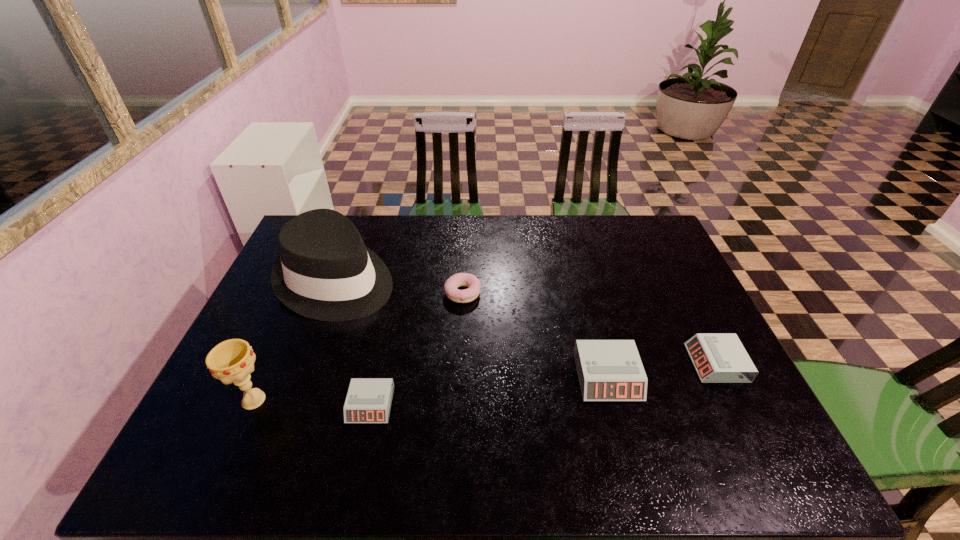
The width and height of the screenshot is (960, 540). What are the coordinates of `object present at the far left corner` in the screenshot? It's located at (325, 272).

Locate an element on the screen. The image size is (960, 540). object that is at the near left corner is located at coordinates point(232,361).

The height and width of the screenshot is (540, 960). Identify the location of free spot at the far edge of the desktop. (601, 230).

At what (x,y) coordinates should I click in order to perform the action: click on free space at the near edge of the desktop. Please return your answer as a coordinate pair (x, y). This screenshot has width=960, height=540. Looking at the image, I should click on (544, 404).

Find the location of a particular element. This screenshot has height=540, width=960. free spot at the right edge of the desktop is located at coordinates (693, 321).

Image resolution: width=960 pixels, height=540 pixels. In the image, there is a desktop. What are the coordinates of `vacant space at the near left corner` in the screenshot? It's located at (267, 396).

Identify the location of vacant space that is in between the doughnut and the tallest alarm clock. The height and width of the screenshot is (540, 960). (535, 334).

Locate an element on the screen. free point between the second object from right to left and the rightmost alarm clock is located at coordinates (661, 370).

Locate an element on the screen. The width and height of the screenshot is (960, 540). free space between the doughnut and the chalice is located at coordinates (358, 347).

You are a GUI agent. You are given a task and a screenshot of the screen. Output one action in this format:
    pyautogui.click(x=<x>, y=<y>)
    Task: Click on the free space between the rightmost object and the doughnut
    
    Given the screenshot: What is the action you would take?
    pyautogui.click(x=589, y=328)